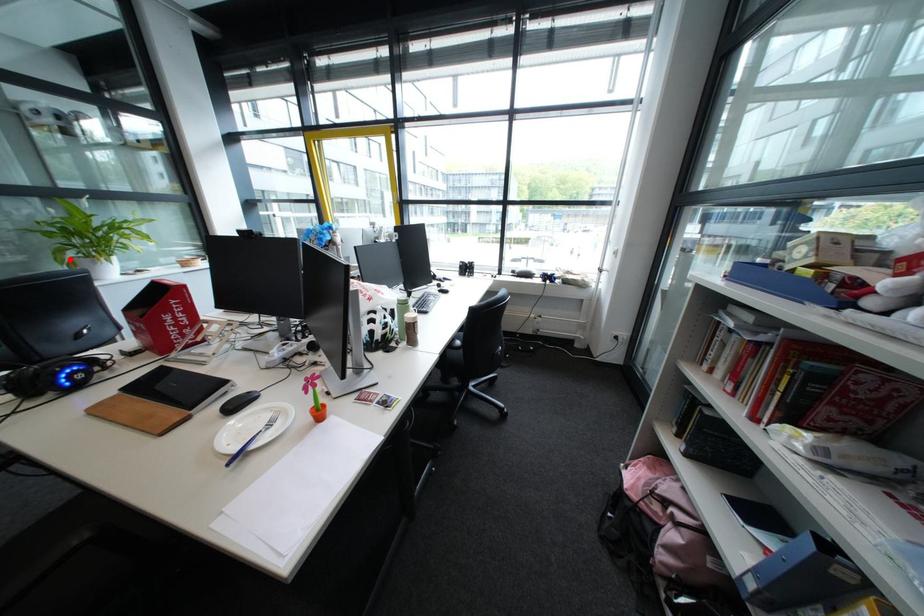
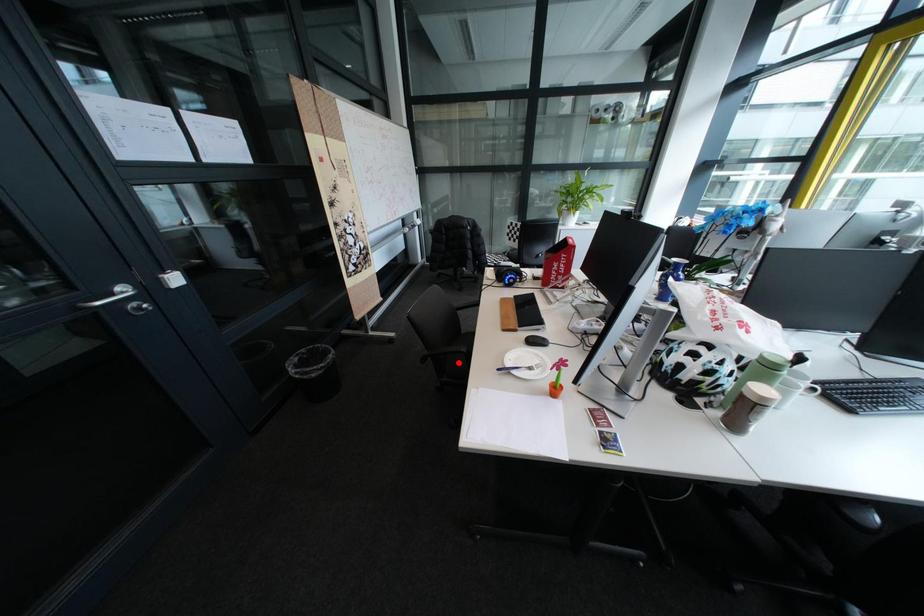
I am providing you with two images of the same scene from different viewpoints. A red point is marked on the first image and another point is marked on the second image. Does the point marked in image1 correspond to the same location as the one in image2?

No